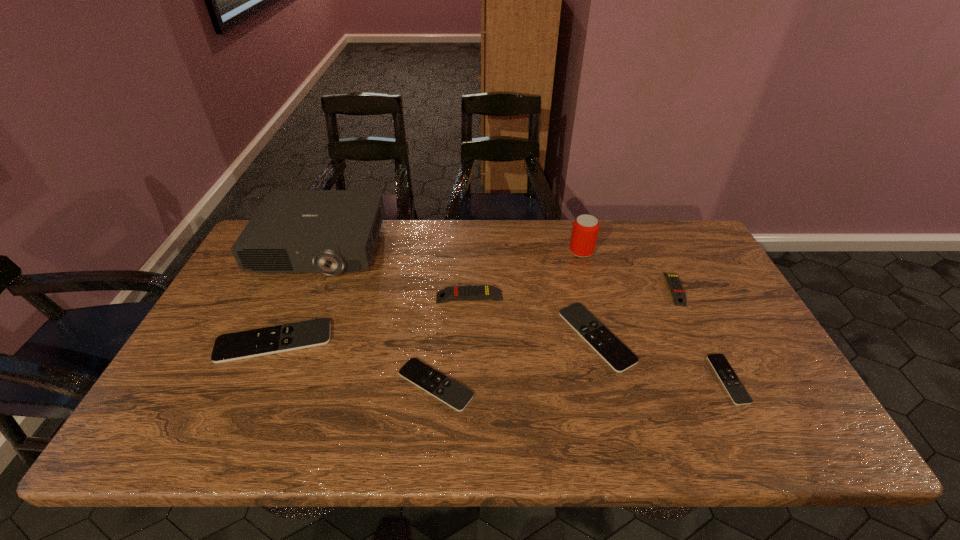
You are a GUI agent. You are given a task and a screenshot of the screen. Output one action in this format:
    pyautogui.click(x=<x>, y=<y>)
    Task: Click on the vacant space located on the left of the third biggest black remote control
    
    Given the screenshot: What is the action you would take?
    pyautogui.click(x=326, y=385)

This screenshot has width=960, height=540. I want to click on free space located 0.050m on the right of the smallest black remote control, so click(x=760, y=379).

Image resolution: width=960 pixels, height=540 pixels. In order to click on projector located at the far edge in this screenshot , I will do (x=293, y=231).

Where is `beer can that is positioned at the far edge`? The image size is (960, 540). beer can that is positioned at the far edge is located at coordinates tap(585, 229).

The image size is (960, 540). In order to click on object at the near edge in this screenshot , I will do `click(455, 395)`.

At what (x,y) coordinates should I click in order to perform the action: click on projector positioned at the left edge. Please return your answer as a coordinate pair (x, y). Looking at the image, I should click on (293, 231).

Identify the location of remote control that is at the left edge. (228, 347).

I want to click on object at the far left corner, so click(x=293, y=231).

This screenshot has height=540, width=960. What are the coordinates of `vacant region at the far edge of the desktop` in the screenshot? It's located at (457, 255).

This screenshot has height=540, width=960. In the image, there is a desktop. Identify the location of vacant space at the near edge. (457, 441).